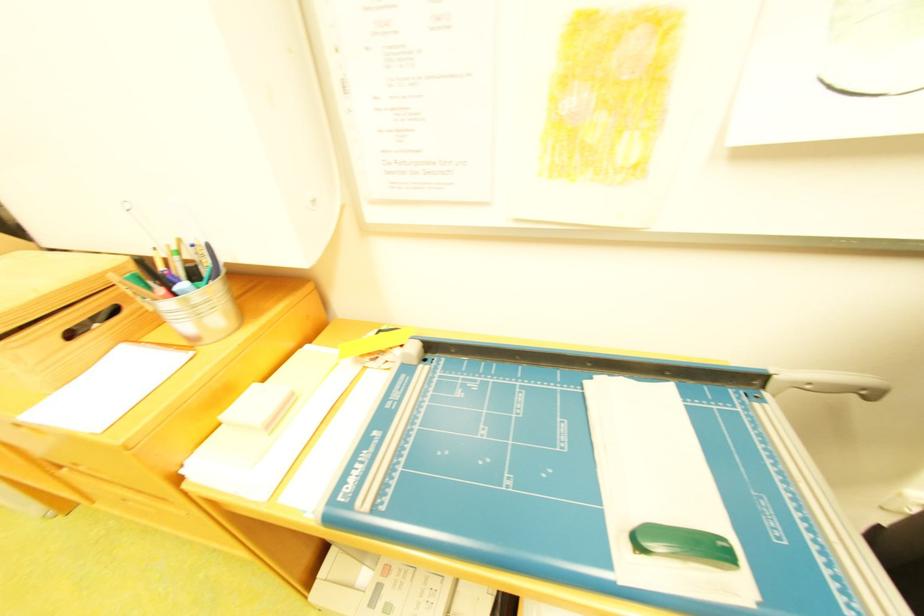
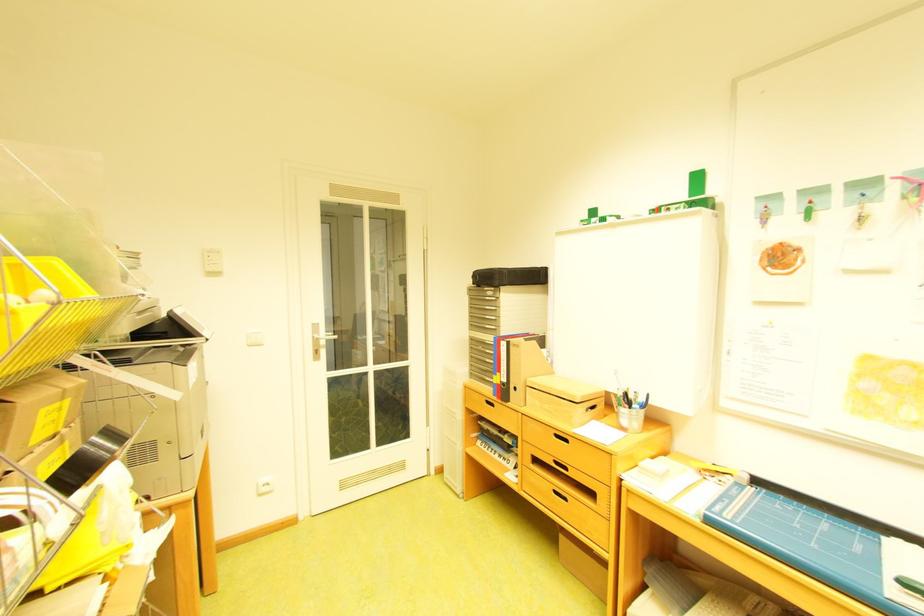
Where in the second image is the point corresponding to point 173,292 from the first image?

(638, 407)